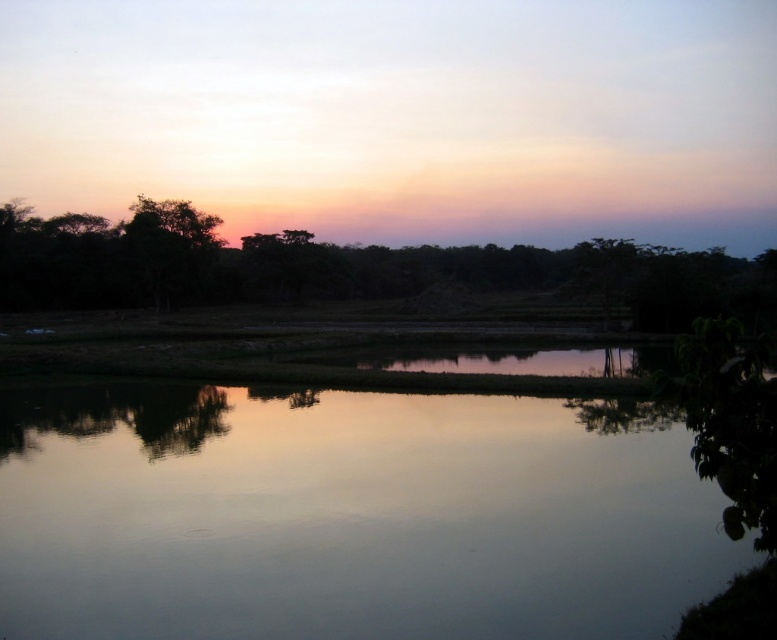
From the picture: Is silvery reflective water at center smaller than silhouette leafy tree at center?

Yes, silvery reflective water at center is smaller than silhouette leafy tree at center.

In the scene shown: Can you confirm if silvery reflective water at center is taller than silhouette leafy tree at center?

No, silvery reflective water at center is not taller than silhouette leafy tree at center.

Is point (72, 636) positioned behind point (215, 237)?

No, it is in front of (215, 237).

Locate an element on the screen. The height and width of the screenshot is (640, 777). silvery reflective water at center is located at coordinates (347, 515).